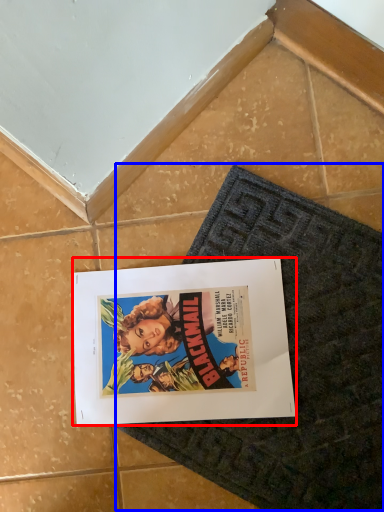
Question: Among these objects, which one is farthest to the camera, poster (highlighted by a red box) or bath mat (highlighted by a blue box)?

Choices:
 (A) poster
 (B) bath mat

Answer: (A)